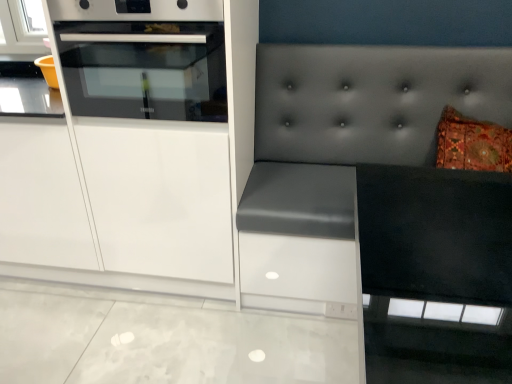
Question: From a real-world perspective, is white glossy cabinet at left positioned under white glossy oven at upper left based on gravity?

Choices:
 (A) yes
 (B) no

Answer: (A)

Question: Does white glossy cabinet at left have a lesser height compared to white glossy oven at upper left?

Choices:
 (A) no
 (B) yes

Answer: (A)

Question: Does white glossy cabinet at left have a larger size compared to white glossy oven at upper left?

Choices:
 (A) yes
 (B) no

Answer: (A)

Question: Is white glossy cabinet at left aimed at white glossy oven at upper left?

Choices:
 (A) yes
 (B) no

Answer: (A)

Question: Considering the relative sizes of white glossy cabinet at left and white glossy oven at upper left in the image provided, is white glossy cabinet at left wider than white glossy oven at upper left?

Choices:
 (A) yes
 (B) no

Answer: (B)

Question: Considering the positions of matte gray cushion at right and white glossy oven at upper left in the image, is matte gray cushion at right bigger or smaller than white glossy oven at upper left?

Choices:
 (A) big
 (B) small

Answer: (A)

Question: Choose the correct answer: Is matte gray cushion at right inside white glossy oven at upper left or outside it?

Choices:
 (A) outside
 (B) inside

Answer: (A)

Question: Considering their positions, is matte gray cushion at right located in front of or behind white glossy oven at upper left?

Choices:
 (A) behind
 (B) front

Answer: (B)

Question: Considering the positions of point (266, 104) and point (208, 61), is point (266, 104) closer or farther from the camera than point (208, 61)?

Choices:
 (A) closer
 (B) farther

Answer: (B)

Question: In terms of size, does white glossy oven at upper left appear bigger or smaller than white glossy cabinet at left?

Choices:
 (A) small
 (B) big

Answer: (A)

Question: Is white glossy oven at upper left taller or shorter than white glossy cabinet at left?

Choices:
 (A) short
 (B) tall

Answer: (A)

Question: Based on their positions, is white glossy oven at upper left located to the left or right of white glossy cabinet at left?

Choices:
 (A) right
 (B) left

Answer: (B)

Question: Is point (203, 44) positioned closer to the camera than point (202, 153)?

Choices:
 (A) closer
 (B) farther

Answer: (A)

Question: Considering the relative positions of white glossy cabinet at left and matte gray cushion at right in the image provided, is white glossy cabinet at left to the left or to the right of matte gray cushion at right?

Choices:
 (A) right
 (B) left

Answer: (B)

Question: Considering the positions of white glossy cabinet at left and matte gray cushion at right in the image, is white glossy cabinet at left taller or shorter than matte gray cushion at right?

Choices:
 (A) tall
 (B) short

Answer: (A)